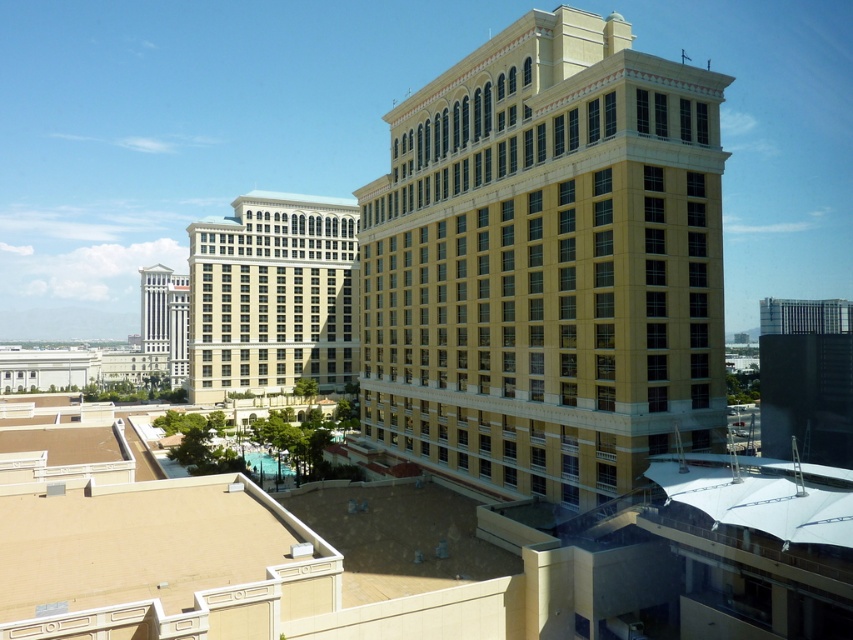
Does yellow stone building at center come in front of beige stone building at center-left?

Yes, it is.

Who is positioned more to the right, yellow stone building at center or beige stone building at center-left?

yellow stone building at center

Describe the element at coordinates (547, 262) in the screenshot. The height and width of the screenshot is (640, 853). I see `yellow stone building at center` at that location.

The height and width of the screenshot is (640, 853). Identify the location of yellow stone building at center. (547, 262).